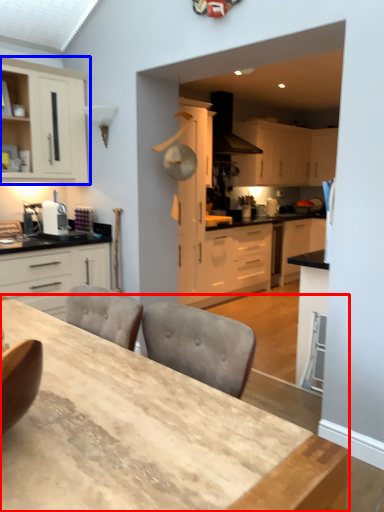
Question: Which object is closer to the camera taking this photo, table (highlighted by a red box) or cabinetry (highlighted by a blue box)?

Choices:
 (A) table
 (B) cabinetry

Answer: (A)